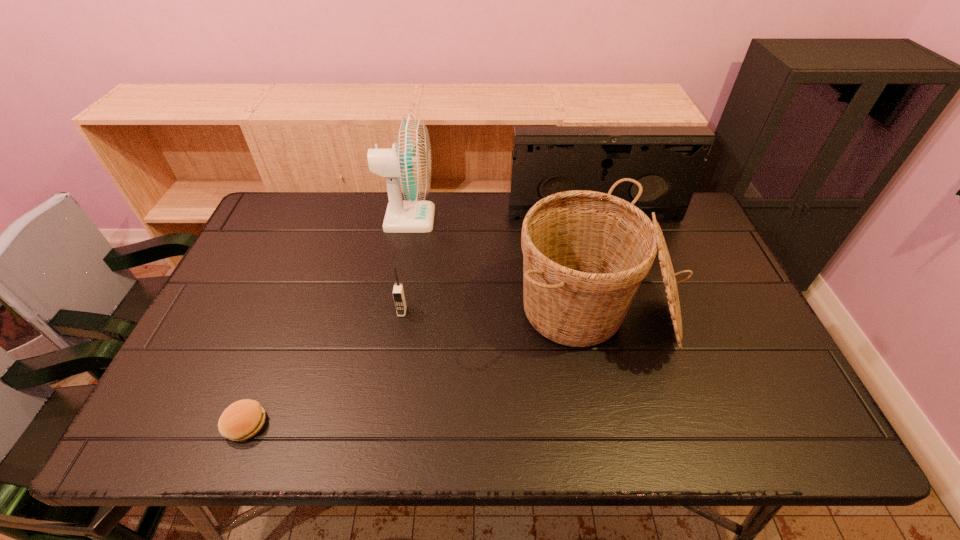
The height and width of the screenshot is (540, 960). What are the coordinates of `vacant region located 0.240m on the right of the nearest object` in the screenshot? It's located at (377, 424).

This screenshot has height=540, width=960. What are the coordinates of `fan at the far edge` in the screenshot? It's located at 407,168.

You are a GUI agent. You are given a task and a screenshot of the screen. Output one action in this format:
    pyautogui.click(x=<x>, y=<y>)
    Task: Click on the videotape that is at the far edge
    This screenshot has width=960, height=540.
    Given the screenshot: What is the action you would take?
    pyautogui.click(x=667, y=161)

This screenshot has width=960, height=540. I want to click on object present at the near edge, so click(243, 419).

Where is `object located at the left edge`? This screenshot has width=960, height=540. object located at the left edge is located at coordinates (243, 419).

The width and height of the screenshot is (960, 540). I want to click on object that is at the right edge, so click(x=667, y=161).

Locate an element on the screen. object that is at the near left corner is located at coordinates (243, 419).

Find the location of a particular element. The width and height of the screenshot is (960, 540). object that is at the far right corner is located at coordinates (667, 161).

The height and width of the screenshot is (540, 960). In order to click on free point at the far edge in this screenshot , I will do `click(330, 226)`.

Locate an element on the screen. The image size is (960, 540). vacant space at the near edge is located at coordinates (598, 420).